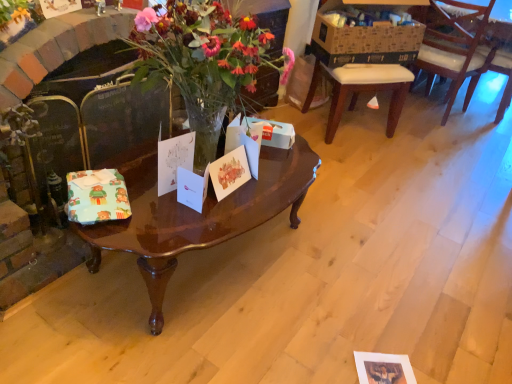
Where is `free space in front of white paper gift card at center, arranged as the third gift card when viewed from the left`? The image size is (512, 384). free space in front of white paper gift card at center, arranged as the third gift card when viewed from the left is located at coordinates (172, 228).